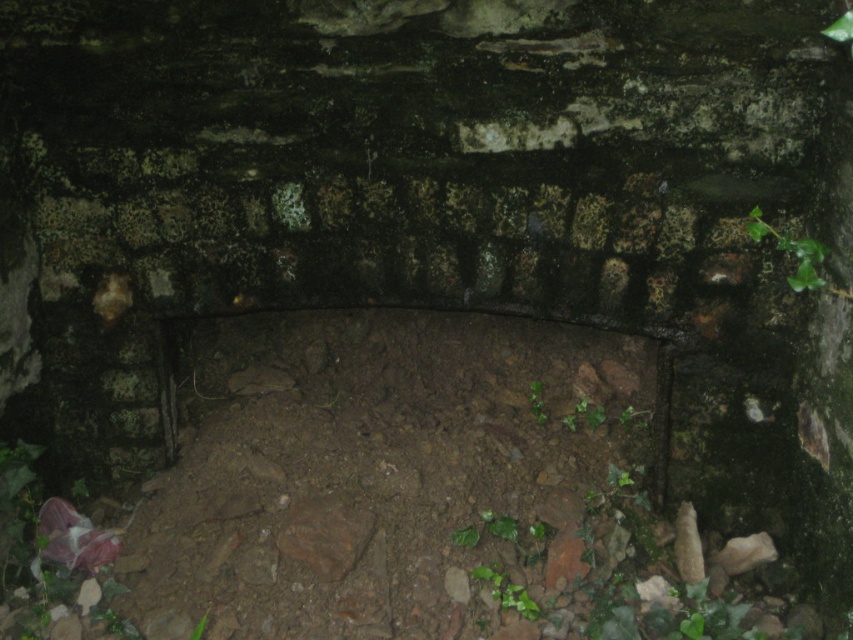
Question: Which of the following is the farthest from the observer?

Choices:
 (A) green leafy plant at upper right
 (B) green leafy plant at center

Answer: (B)

Question: Among these points, which one is nearest to the camera?

Choices:
 (A) (807, 289)
 (B) (495, 572)

Answer: (A)

Question: Does green leafy plant at upper right have a greater width compared to green leafy plant at center?

Choices:
 (A) yes
 (B) no

Answer: (B)

Question: Which point is closer to the camera?

Choices:
 (A) green leafy plant at upper right
 (B) green leafy plant at center

Answer: (A)

Question: Is green leafy plant at upper right wider than green leafy plant at center?

Choices:
 (A) yes
 (B) no

Answer: (B)

Question: Is green leafy plant at upper right to the right of green leafy plant at center from the viewer's perspective?

Choices:
 (A) yes
 (B) no

Answer: (A)